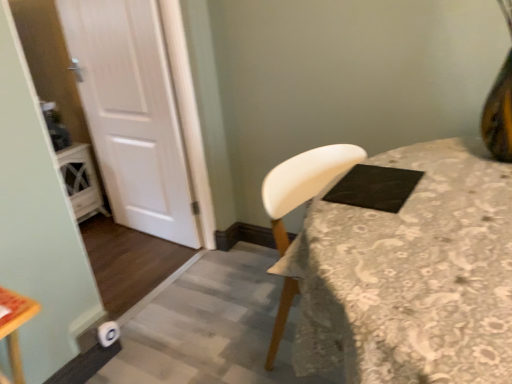
Identify the location of empty space that is to the right of black matte pad at upper right. (434, 177).